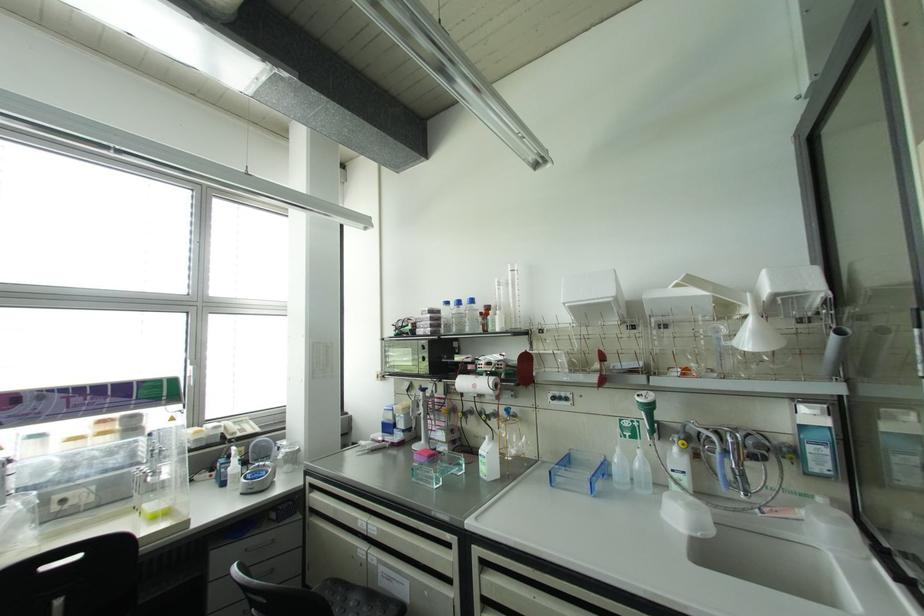
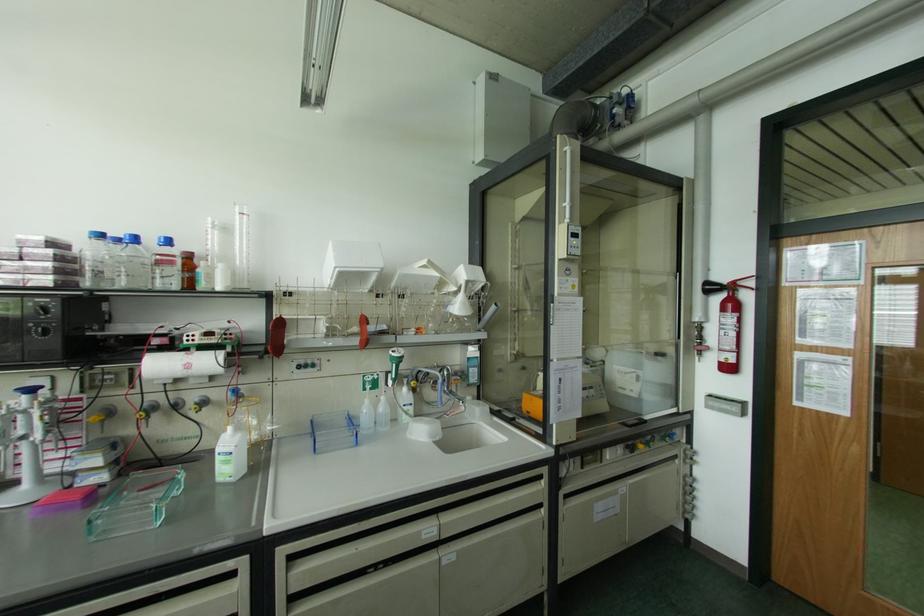
The point at (491, 445) is marked in the first image. Where is the corresponding point in the second image?

(238, 435)